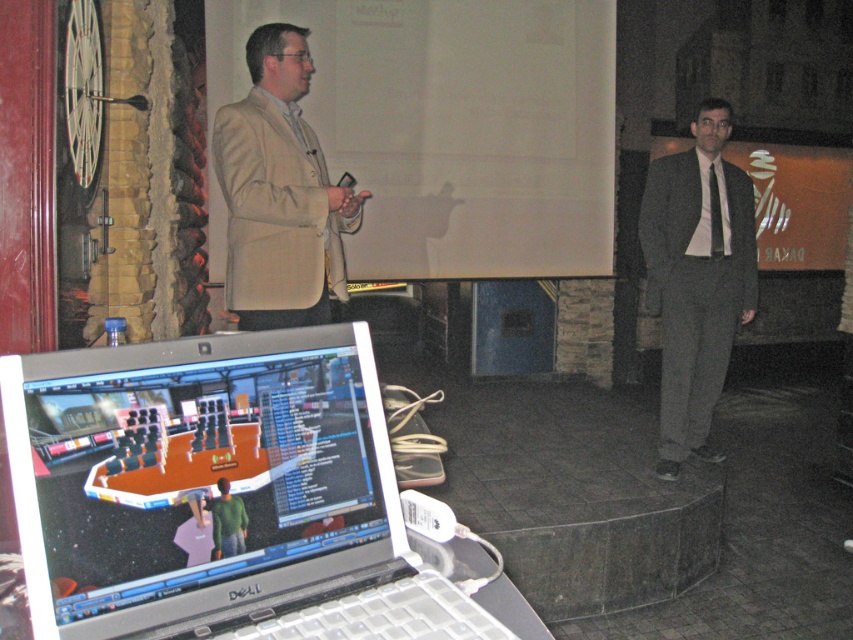
Question: Is white matte projection screen at upper center to the left of beige fabric suit at upper left from the viewer's perspective?

Choices:
 (A) yes
 (B) no

Answer: (B)

Question: Among these points, which one is farthest from the camera?

Choices:
 (A) (337, 278)
 (B) (663, 173)
 (C) (136, 392)
 (D) (379, 72)

Answer: (D)

Question: Which object is the farthest from the black striped tie at right?

Choices:
 (A) dark gray suit at right
 (B) white matte projection screen at upper center
 (C) silver plastic laptop at lower left
 (D) beige fabric suit at upper left

Answer: (C)

Question: Is beige fabric suit at upper left to the left of dark gray suit at right from the viewer's perspective?

Choices:
 (A) yes
 (B) no

Answer: (A)

Question: Does beige fabric suit at upper left appear on the right side of black striped tie at right?

Choices:
 (A) yes
 (B) no

Answer: (B)

Question: Estimate the real-world distances between objects in this image. Which object is closer to the white matte projection screen at upper center?

Choices:
 (A) silver plastic laptop at lower left
 (B) dark gray suit at right
 (C) black striped tie at right

Answer: (B)